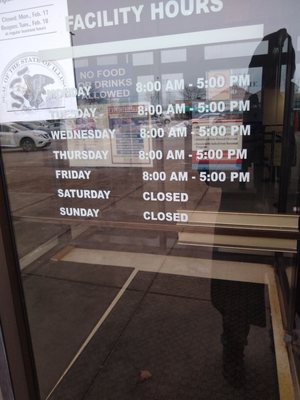
You are a GUI agent. You are given a task and a screenshot of the screen. Output one action in this format:
    pyautogui.click(x=<x>, y=<y>)
    Task: Click on the piece of paper
    
    Given the screenshot: What is the action you would take?
    pyautogui.click(x=17, y=45)